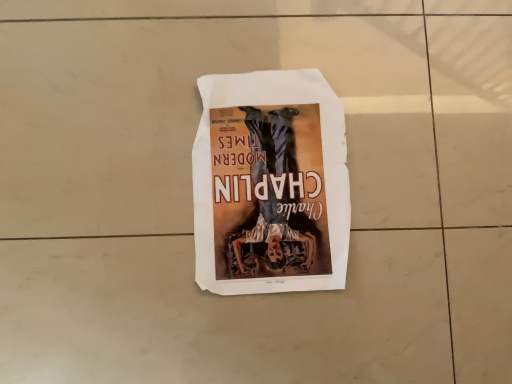
This screenshot has width=512, height=384. Identify the location of free point above matte paper poster at center (from a real-world perspective). (265, 175).